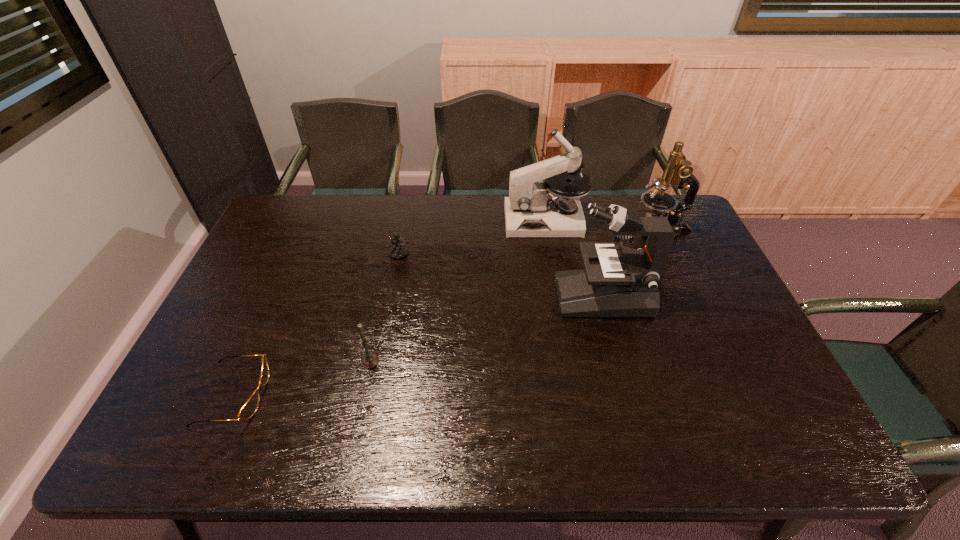
Select which object is the fourth closest to the nearest microscope. Please provide its 2D coordinates. Your answer should be formatted as a tuple, i.e. [(x, y)], where the tuple contains the x and y coordinates of a point satisfying the conditions above.

[(370, 360)]

Where is `object that stands as the fifth closest to the candle`? This screenshot has width=960, height=540. object that stands as the fifth closest to the candle is located at coordinates (678, 172).

The height and width of the screenshot is (540, 960). Identify the location of the second closest microscope relative to the fourth farthest object. (533, 209).

Locate which microscope ranks third in proximity to the second shortest object. Please provide its 2D coordinates. Your answer should be formatted as a tuple, i.e. [(x, y)], where the tuple contains the x and y coordinates of a point satisfying the conditions above.

[(678, 172)]

Identify the location of free space that satisfies the following two spatial constraints: 1. at the eyepiece of the rightmost microscope; 2. on the front side of the pinecone. This screenshot has height=540, width=960. (673, 254).

Locate an element on the screen. vacant space that satisfies the following two spatial constraints: 1. on the front side of the pinecone; 2. on the front-facing side of the shortest object is located at coordinates (371, 395).